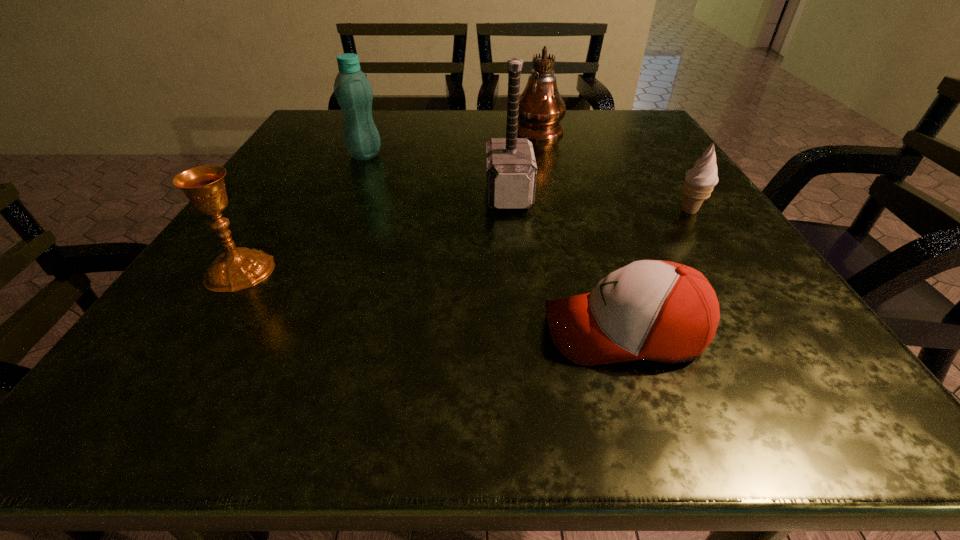
At what (x,y) coordinates should I click in order to perform the action: click on object present at the far left corner. Please return your answer as a coordinate pair (x, y). The image size is (960, 540). Looking at the image, I should click on (353, 91).

The height and width of the screenshot is (540, 960). What are the coordinates of `object that is at the near right corner` in the screenshot? It's located at (663, 311).

In the image, there is a desktop. At what (x,y) coordinates should I click in order to perform the action: click on vacant space at the far edge. Please return your answer as a coordinate pair (x, y). The width and height of the screenshot is (960, 540). Looking at the image, I should click on (440, 115).

In the image, there is a desktop. Where is `vacant space at the near edge`? This screenshot has height=540, width=960. vacant space at the near edge is located at coordinates (473, 353).

Find the location of a particular element. This screenshot has width=960, height=540. blank space at the left edge is located at coordinates [223, 316].

What are the coordinates of `vacant position at the right edge of the desktop` in the screenshot? It's located at (667, 190).

Locate an element on the screen. The image size is (960, 540). free space at the far left corner is located at coordinates (320, 126).

Image resolution: width=960 pixels, height=540 pixels. I want to click on free region at the far right corner, so click(629, 148).

Identify the location of vacant space at the near right corner. The image size is (960, 540). (791, 413).

Identify the location of free space that is in between the fourth shortest object and the leftmost object. This screenshot has height=540, width=960. (302, 212).